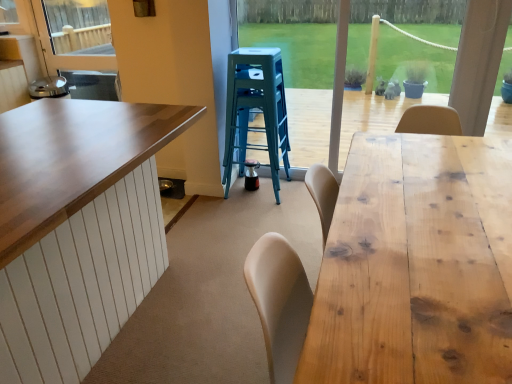
Question: Relative to natural wood table at right, is teal plastic stool at center in front or behind?

Choices:
 (A) behind
 (B) front

Answer: (A)

Question: Is teal plastic stool at center inside or outside of natural wood table at right?

Choices:
 (A) outside
 (B) inside

Answer: (A)

Question: Considering the real-world distances, which object is closest to the teal plastic stool at center?

Choices:
 (A) wooden frame at center
 (B) natural wood table at right

Answer: (B)

Question: Estimate the real-world distances between objects in this image. Which object is farther from the natural wood table at right?

Choices:
 (A) teal plastic stool at center
 (B) wooden frame at center

Answer: (B)